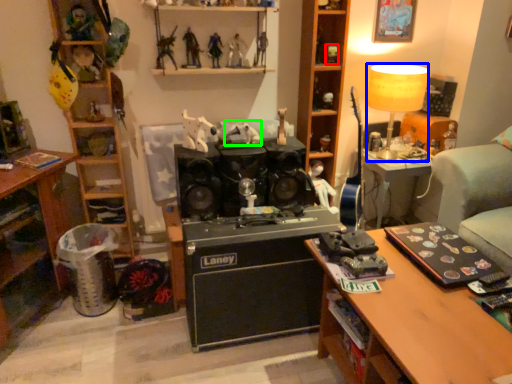
Question: Considering the real-world distances, which object is farthest from toy (highlighted by a red box)? lamp (highlighted by a blue box) or toy (highlighted by a green box)?

Choices:
 (A) lamp
 (B) toy

Answer: (B)